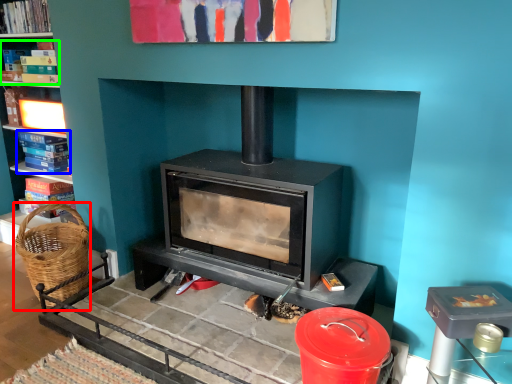
Question: Which is nearer to the basket (highlighted by a red box)? book (highlighted by a blue box) or book (highlighted by a green box).

Choices:
 (A) book
 (B) book

Answer: (A)